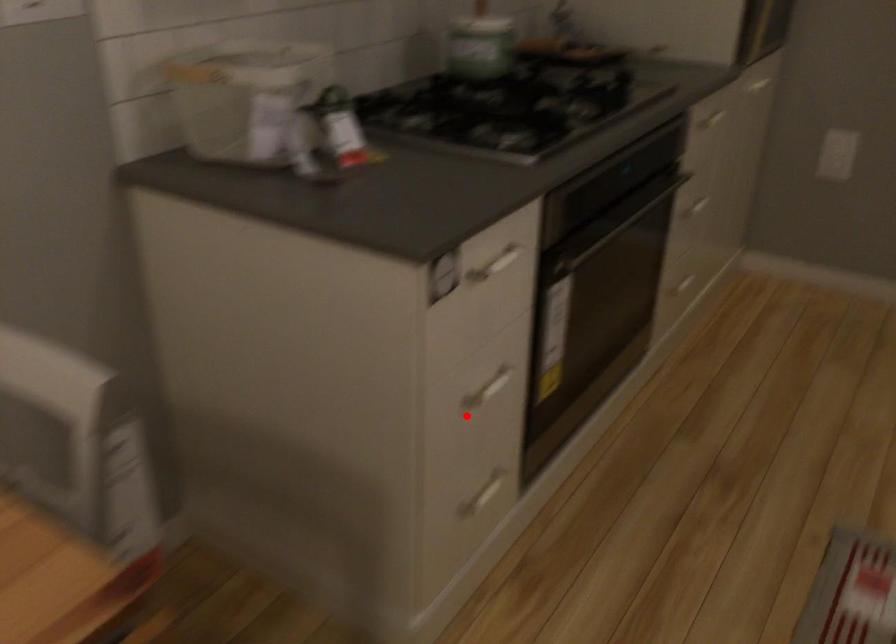
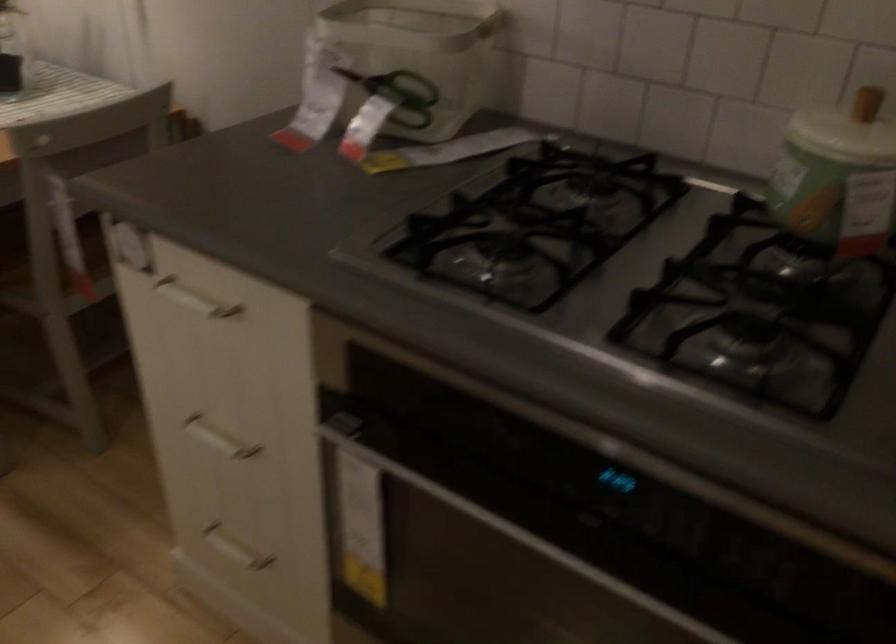
Where in the second image is the point corresponding to the highlighted location from the first image?

(218, 438)